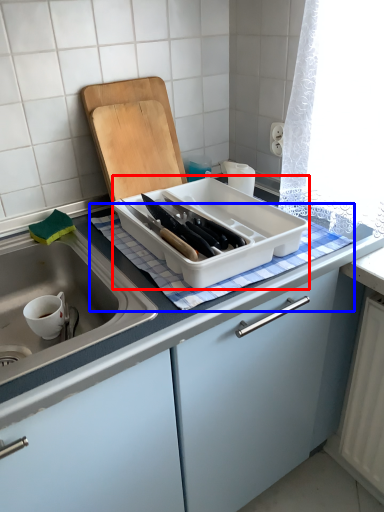
Question: Which object is further to the camera taking this photo, kitchen appliance (highlighted by a red box) or tablecloth (highlighted by a blue box)?

Choices:
 (A) kitchen appliance
 (B) tablecloth

Answer: (B)